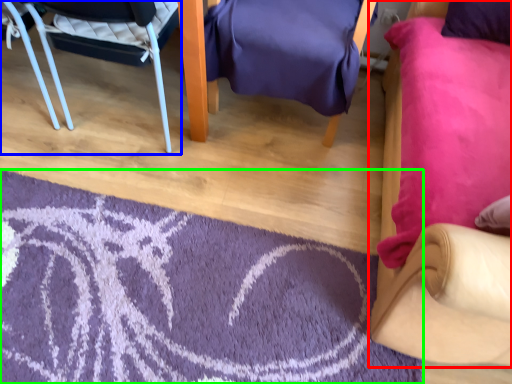
Question: Considering the real-world distances, which object is closest to chair (highlighted by a red box)? chair (highlighted by a blue box) or mat (highlighted by a green box).

Choices:
 (A) chair
 (B) mat

Answer: (B)